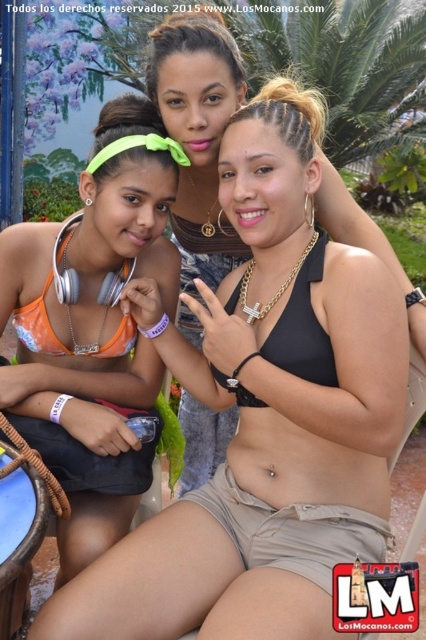
Question: Among these points, which one is farthest from the camera?

Choices:
 (A) click(215, 90)
 (B) click(161, 292)

Answer: (B)

Question: Can you confirm if orange fabric bikini top at left is positioned above black matte bikini top at center?

Choices:
 (A) no
 (B) yes

Answer: (A)

Question: Is orange fabric bikini top at left to the left of black matte bikini top at center from the viewer's perspective?

Choices:
 (A) no
 (B) yes

Answer: (B)

Question: Does orange fabric bikini top at left have a greater width compared to black matte bikini top at center?

Choices:
 (A) no
 (B) yes

Answer: (B)